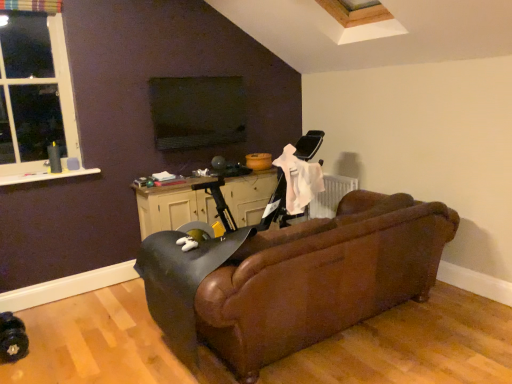
Question: Should I look upward or downward to see brown leather couch at center?

Choices:
 (A) up
 (B) down

Answer: (B)

Question: Does black matte table at center have a greater width compared to leather swivel chair at center?

Choices:
 (A) yes
 (B) no

Answer: (B)

Question: From a real-world perspective, is black matte table at center positioned over leather swivel chair at center based on gravity?

Choices:
 (A) yes
 (B) no

Answer: (A)

Question: Is black matte table at center bigger than leather swivel chair at center?

Choices:
 (A) no
 (B) yes

Answer: (A)

Question: From a real-world perspective, is black matte table at center located beneath leather swivel chair at center?

Choices:
 (A) no
 (B) yes

Answer: (A)

Question: Considering the relative positions of black matte table at center and leather swivel chair at center in the image provided, is black matte table at center to the right of leather swivel chair at center from the viewer's perspective?

Choices:
 (A) no
 (B) yes

Answer: (A)

Question: Can you confirm if black matte table at center is thinner than leather swivel chair at center?

Choices:
 (A) no
 (B) yes

Answer: (B)

Question: From a real-world perspective, is brown leather couch at center located beneath black matte table at center?

Choices:
 (A) yes
 (B) no

Answer: (A)

Question: Considering the relative sizes of brown leather couch at center and black matte table at center in the image provided, is brown leather couch at center wider than black matte table at center?

Choices:
 (A) yes
 (B) no

Answer: (A)

Question: Considering the relative sizes of brown leather couch at center and black matte table at center in the image provided, is brown leather couch at center bigger than black matte table at center?

Choices:
 (A) yes
 (B) no

Answer: (A)

Question: Can you confirm if brown leather couch at center is smaller than black matte table at center?

Choices:
 (A) no
 (B) yes

Answer: (A)

Question: Does brown leather couch at center have a lesser height compared to black matte table at center?

Choices:
 (A) yes
 (B) no

Answer: (B)

Question: Considering the relative positions of brown leather couch at center and black matte table at center in the image provided, is brown leather couch at center to the left of black matte table at center from the viewer's perspective?

Choices:
 (A) yes
 (B) no

Answer: (B)

Question: Considering the relative sizes of leather swivel chair at center and white plastic window at upper left in the image provided, is leather swivel chair at center bigger than white plastic window at upper left?

Choices:
 (A) no
 (B) yes

Answer: (B)